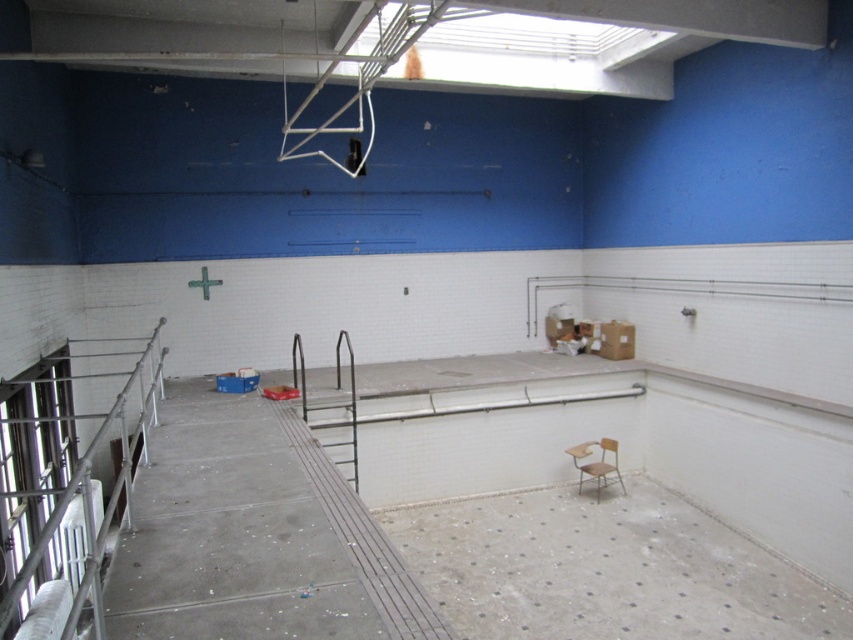
You are a maintenance worker needing to secure the silver metallic railing at left and the wooden chair at center. Which object requires more material due to its size?

The silver metallic railing at left requires more material because it has a larger size compared to the wooden chair at center.

You are standing at the edge of the pool and want to reach the chair near the right side. Which rail should you grab to avoid obstacles? The silver metallic railing at left or the metallic gray rail at center?

You should grab the metallic gray rail at center because the silver metallic railing at left is above it, so the metallic gray rail at center is closer to your position at the pool edge.